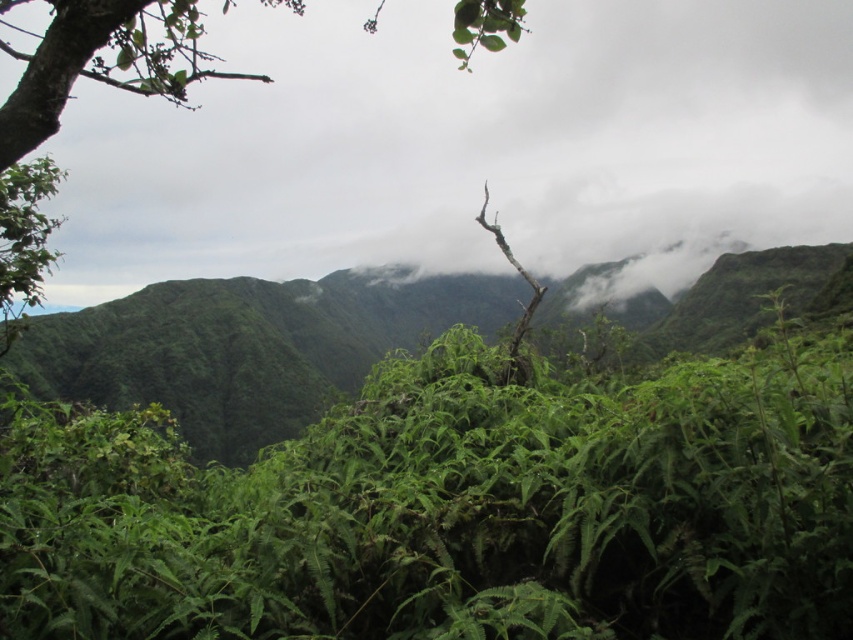
You are a hiker trying to navigate through the dense greenery in the image. You need to pass between the green leafy shrubs at center and the green leafy tree at upper center. Which one is narrower so you can choose the correct path?

The green leafy shrubs at center has a lesser width compared to the green leafy tree at upper center, so the shrubs are narrower. You should choose the path between the green leafy shrubs at center to navigate through as it is narrower.

You are a hiker standing in the lush landscape and want to take a photo of both the green leafy shrubs at center and the green leafy tree at upper center. Which object should you focus on first to ensure both are in sharp focus?

You should focus on the green leafy shrubs at center first because it is closer to you than the green leafy tree at upper center. By focusing on the closer object, you can ensure both are in focus using the depth of field.